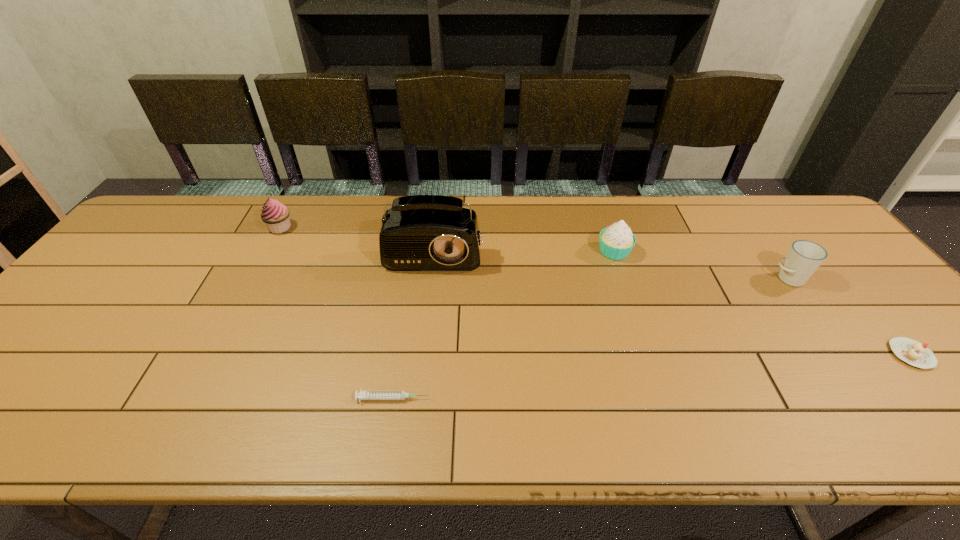
Identify the location of radio receiver. (420, 232).

The image size is (960, 540). I want to click on the leftmost cupcake, so click(275, 215).

The height and width of the screenshot is (540, 960). Identify the location of the leftmost object. (275, 215).

Where is `the second cupcake from left to right`? the second cupcake from left to right is located at coordinates (616, 242).

You are a GUI agent. You are given a task and a screenshot of the screen. Output one action in this format:
    pyautogui.click(x=<x>, y=<y>)
    Task: Click on the second nearest cupcake
    Image resolution: width=960 pixels, height=540 pixels.
    Given the screenshot: What is the action you would take?
    pyautogui.click(x=616, y=242)

The image size is (960, 540). Find the location of `the fifth object from left to right`. the fifth object from left to right is located at coordinates (804, 257).

Where is `the shortest cupcake`? the shortest cupcake is located at coordinates (912, 352).

Identify the location of the second nearest object. The image size is (960, 540). (912, 352).

Image resolution: width=960 pixels, height=540 pixels. I want to click on the shortest object, so click(x=362, y=395).

You are a GUI agent. You are given a task and a screenshot of the screen. Output one action in this format:
    pyautogui.click(x=<x>, y=<y>)
    Task: Click on the nearest object
    The image size is (960, 540).
    Given the screenshot: What is the action you would take?
    pyautogui.click(x=362, y=395)